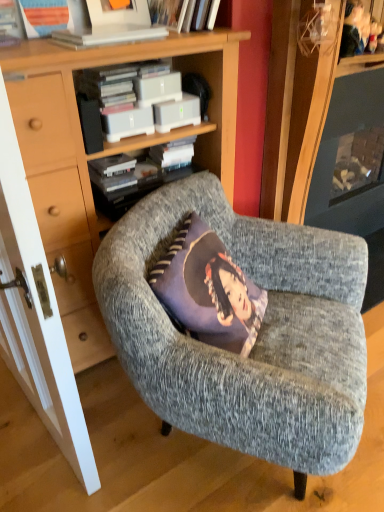
Question: Considering the positions of point (122, 309) and point (134, 26), is point (122, 309) closer or farther from the camera than point (134, 26)?

Choices:
 (A) closer
 (B) farther

Answer: (A)

Question: From the image's perspective, relative to white plastic book at upper center, is textured gray armchair at center above or below?

Choices:
 (A) above
 (B) below

Answer: (B)

Question: Estimate the real-world distances between objects in this image. Which object is farther from the wooden bookcase at center?

Choices:
 (A) textured gray armchair at center
 (B) white plastic book at upper center
 (C) white matte book at upper center
 (D) white wood door at left

Answer: (C)

Question: Which object is positioned closest to the textured gray armchair at center?

Choices:
 (A) wooden bookcase at center
 (B) white wood door at left
 (C) white plastic book at upper center
 (D) white matte book at upper center

Answer: (A)